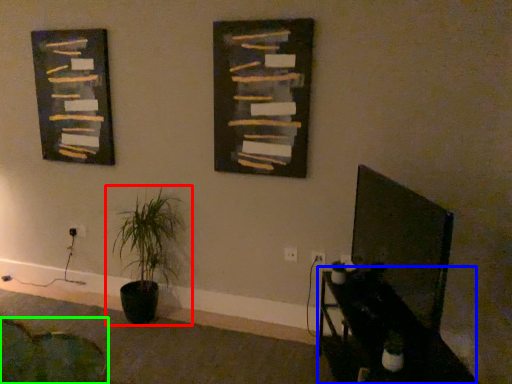
Question: Estimate the real-world distances between objects in this image. Which object is closer to houseplant (highlighted by a red box), table (highlighted by a blue box) or swivel chair (highlighted by a green box)?

Choices:
 (A) table
 (B) swivel chair

Answer: (B)